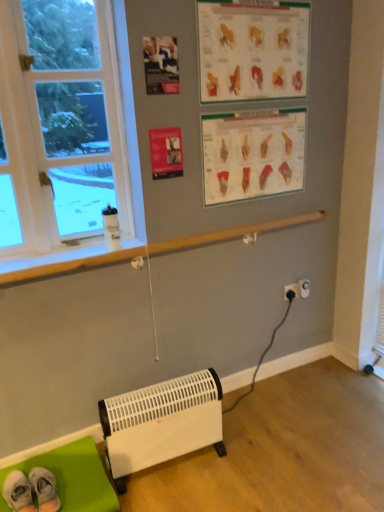
The height and width of the screenshot is (512, 384). I want to click on vacant area located to the right-hand side of white fabric socks at lower left, so click(x=83, y=479).